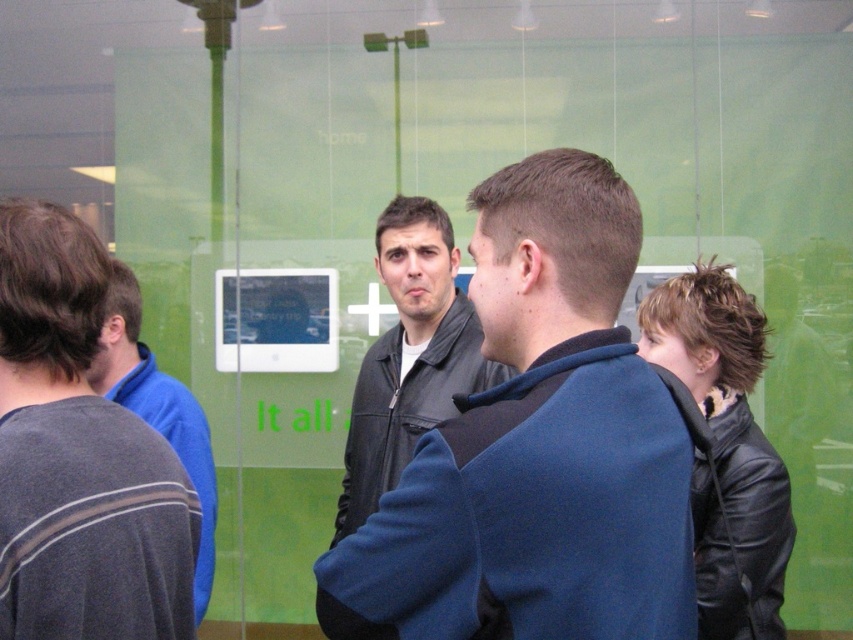
You are standing at the point with coordinates point (86, 465) and want to see the point at point (567, 205). Is there any obstruction between you and that point?

Point (567, 205) is in front of point (86, 465), so there is an obstruction between them.

You are standing in the room and want to greet the person wearing the leather jacket at center and the person wearing the dark gray sweater at left. Which person should you approach first if you want to greet the one closer to you?

The dark gray sweater at left is closer to you than the leather jacket at center, so you should greet the person wearing the dark gray sweater at left first.